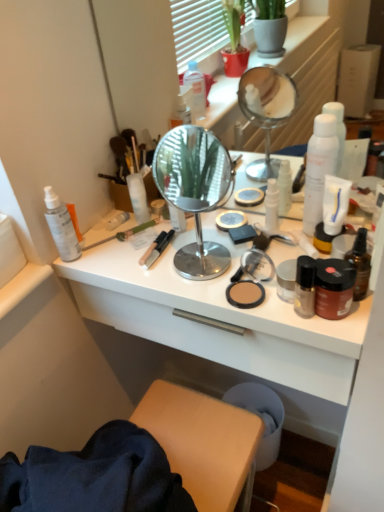
Question: Does brown glass bottle at right, positioned as the 2th bottle in top-to-bottom order, have a lesser width compared to white matte spray can at right, which is the first bottle from back to front?

Choices:
 (A) no
 (B) yes

Answer: (B)

Question: Is brown glass bottle at right, positioned as the 2th bottle in top-to-bottom order, bigger than white matte spray can at right, which is the first bottle from back to front?

Choices:
 (A) yes
 (B) no

Answer: (B)

Question: From the image's perspective, is brown glass bottle at right, which is counted as the second bottle, starting from the back, under white matte spray can at right, which is the 2th bottle from bottom to top?

Choices:
 (A) yes
 (B) no

Answer: (A)

Question: From a real-world perspective, is brown glass bottle at right, which is counted as the second bottle, starting from the back, positioned under white matte spray can at right, the second bottle from the front, based on gravity?

Choices:
 (A) yes
 (B) no

Answer: (A)

Question: Does brown glass bottle at right, which is counted as the second bottle, starting from the back, touch white matte spray can at right, which is the 2th bottle from bottom to top?

Choices:
 (A) no
 (B) yes

Answer: (A)

Question: Is white glossy desk at center inside or outside of white matte bottle at center, the 5th toiletry viewed from the right?

Choices:
 (A) outside
 (B) inside

Answer: (A)

Question: Is white glossy desk at center bigger or smaller than white matte bottle at center, the 5th toiletry viewed from the right?

Choices:
 (A) big
 (B) small

Answer: (A)

Question: From a real-world perspective, is white glossy desk at center positioned above or below white matte bottle at center, the 4th toiletry positioned from the left?

Choices:
 (A) below
 (B) above

Answer: (A)

Question: Does point (332, 415) appear closer or farther from the camera than point (140, 181)?

Choices:
 (A) closer
 (B) farther

Answer: (B)

Question: Is brown glass bottle at right, marked as the 1th bottle in a front-to-back arrangement, to the left or to the right of white matte bottle at center, the 4th toiletry positioned from the left, in the image?

Choices:
 (A) left
 (B) right

Answer: (B)

Question: Looking at their shapes, would you say brown glass bottle at right, positioned as the 2th bottle in top-to-bottom order, is wider or thinner than white matte bottle at center, the 4th toiletry positioned from the left?

Choices:
 (A) thin
 (B) wide

Answer: (A)

Question: Considering the positions of brown glass bottle at right, which is counted as the second bottle, starting from the back, and white matte bottle at center, the 4th toiletry positioned from the left, in the image, is brown glass bottle at right, which is counted as the second bottle, starting from the back, bigger or smaller than white matte bottle at center, the 4th toiletry positioned from the left,?

Choices:
 (A) big
 (B) small

Answer: (B)

Question: From the image's perspective, relative to white matte bottle at center, the 5th toiletry viewed from the right, is brown glass bottle at right, which ranks as the first bottle in bottom-to-top order, above or below?

Choices:
 (A) below
 (B) above

Answer: (A)

Question: Is polished chrome mirror at center situated inside matte gold jar at center right, which ranks as the eighth toiletry in left-to-right order, or outside?

Choices:
 (A) inside
 (B) outside

Answer: (B)

Question: Based on their positions, is polished chrome mirror at center located to the left or right of matte gold jar at center right, which ranks as the eighth toiletry in left-to-right order?

Choices:
 (A) right
 (B) left

Answer: (B)